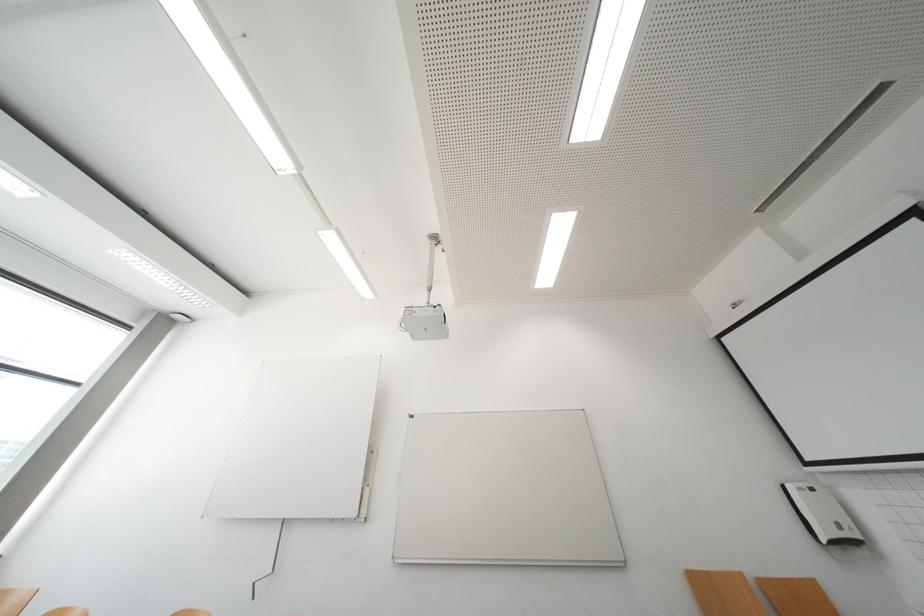
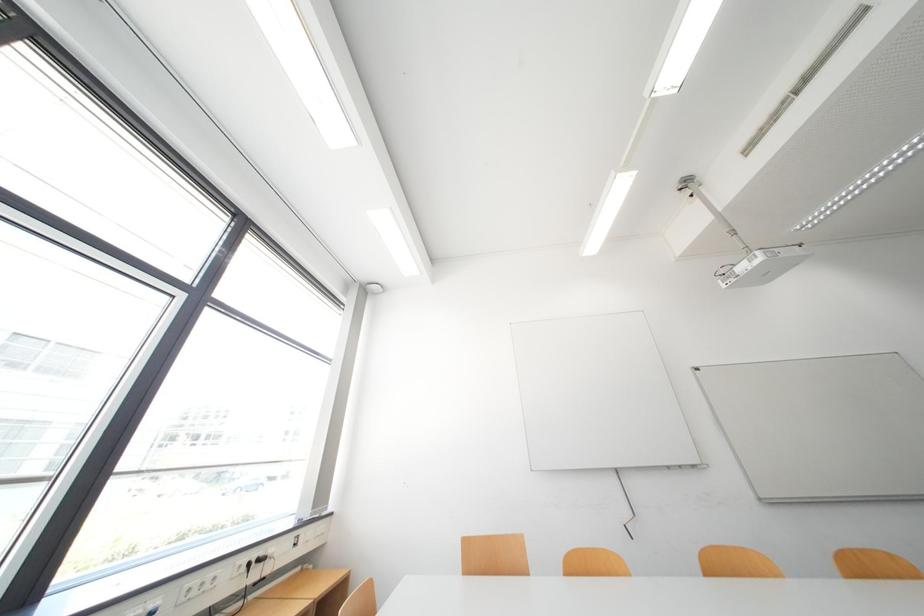
Question: What movement of the cameraman would produce the second image?

Choices:
 (A) Left
 (B) Right
 (C) Forward
 (D) Backward

Answer: (A)